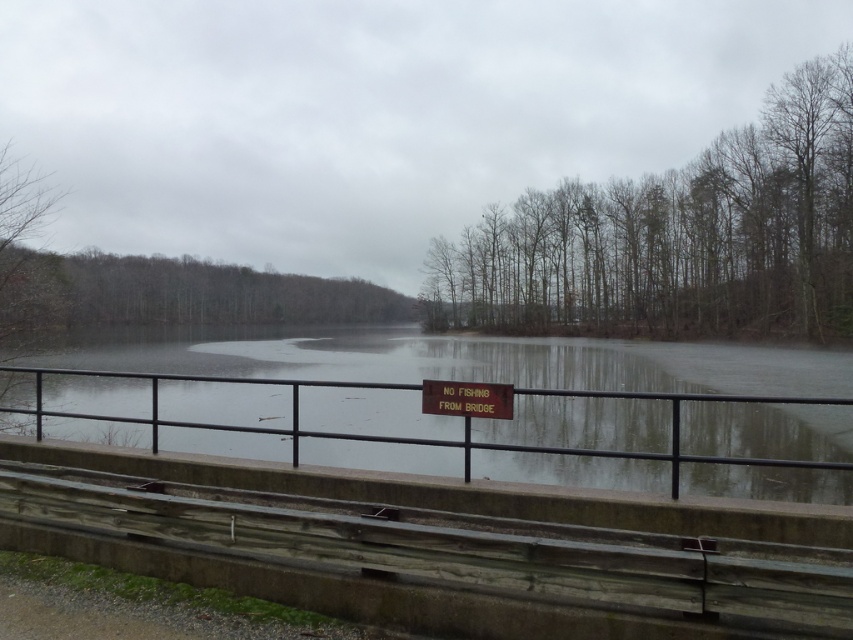
Question: Observing the image, what is the correct spatial positioning of smooth concrete river at center in reference to matte brown sign at center?

Choices:
 (A) below
 (B) above

Answer: (A)

Question: Does smooth concrete river at center have a smaller size compared to matte brown sign at center?

Choices:
 (A) no
 (B) yes

Answer: (A)

Question: Which object is farther from the camera taking this photo?

Choices:
 (A) matte brown sign at center
 (B) smooth concrete river at center

Answer: (A)

Question: Among these points, which one is farthest from the camera?

Choices:
 (A) (480, 413)
 (B) (422, 449)

Answer: (B)

Question: Is smooth concrete river at center below matte brown sign at center?

Choices:
 (A) yes
 (B) no

Answer: (A)